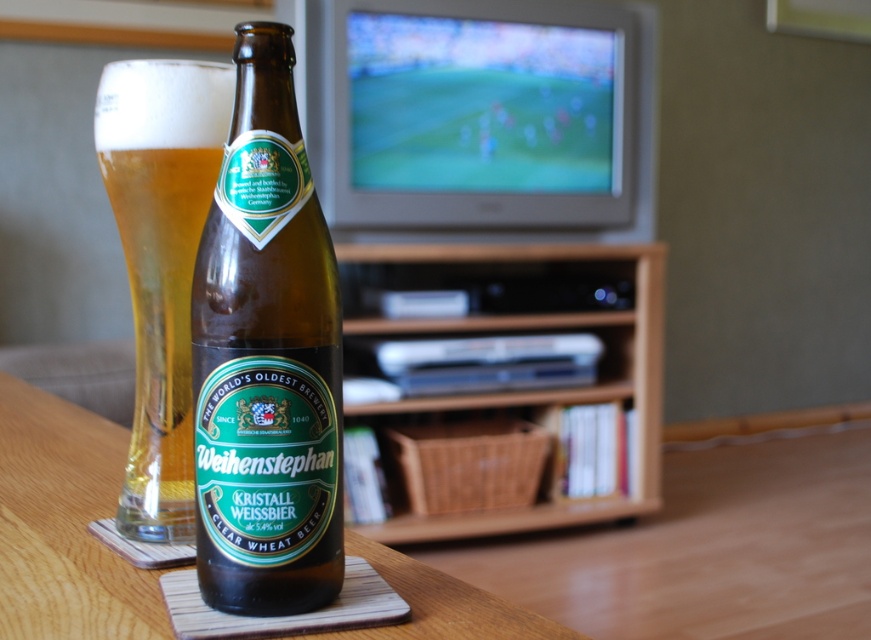
Question: Which object appears farthest from the camera in this image?

Choices:
 (A) clear glass beer at center
 (B) brown glass beer bottle at center
 (C) wooden coaster at center

Answer: (A)

Question: Does brown glass beer bottle at center appear over wooden coaster at center?

Choices:
 (A) no
 (B) yes

Answer: (B)

Question: Is brown glass beer bottle at center above clear glass beer at center?

Choices:
 (A) no
 (B) yes

Answer: (A)

Question: Is brown glass beer bottle at center smaller than clear glass beer at center?

Choices:
 (A) yes
 (B) no

Answer: (A)

Question: Which of the following is the closest to the observer?

Choices:
 (A) clear glass beer at center
 (B) brown glass beer bottle at center

Answer: (B)

Question: Which point is closer to the camera?

Choices:
 (A) (366, 252)
 (B) (186, 502)
 (C) (294, 296)
 (D) (385, 557)

Answer: (C)